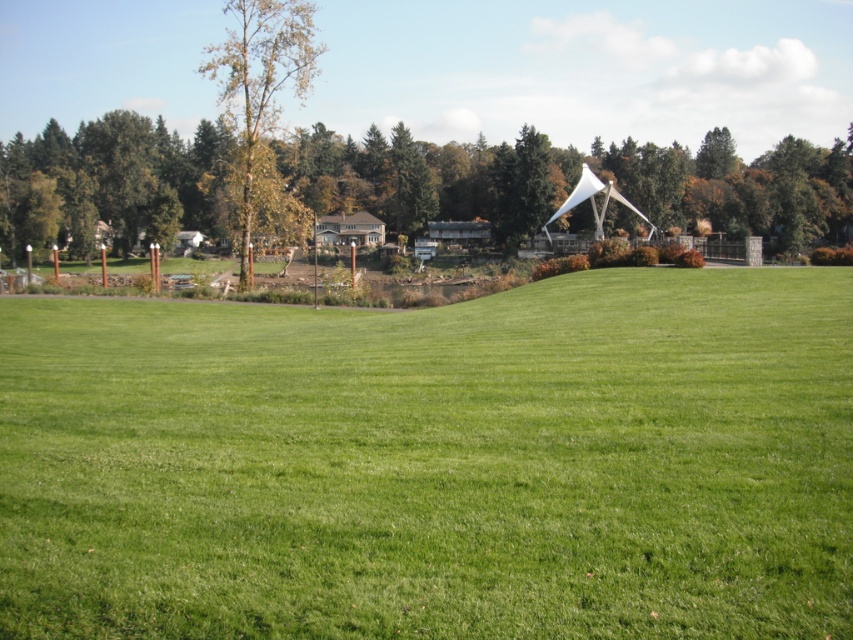
Is green leafy tree at upper left to the right of green matte tree at upper center from the viewer's perspective?

Incorrect, green leafy tree at upper left is not on the right side of green matte tree at upper center.

Between point (239, 280) and point (508, 148), which one is positioned in front?

Point (239, 280)

Image resolution: width=853 pixels, height=640 pixels. Find the location of `green leafy tree at upper left`. green leafy tree at upper left is located at coordinates (260, 83).

Who is more distant from viewer, (x=236, y=192) or (x=531, y=212)?

Positioned behind is point (x=531, y=212).

Is point (160, 189) less distant than point (518, 170)?

No.

The height and width of the screenshot is (640, 853). Identify the location of brown wood tree at upper center. (553, 182).

Is green grass at center thinner than brown wood tree at upper center?

Indeed, green grass at center has a lesser width compared to brown wood tree at upper center.

Does point (535, 579) lie in front of point (683, 168)?

That is True.

Is point (842, 412) closer to viewer compared to point (515, 156)?

Yes, point (842, 412) is closer to viewer.

You are a GUI agent. You are given a task and a screenshot of the screen. Output one action in this format:
    pyautogui.click(x=<x>, y=<y>)
    Task: Click on the green grass at center
    
    Given the screenshot: What is the action you would take?
    coord(434,464)